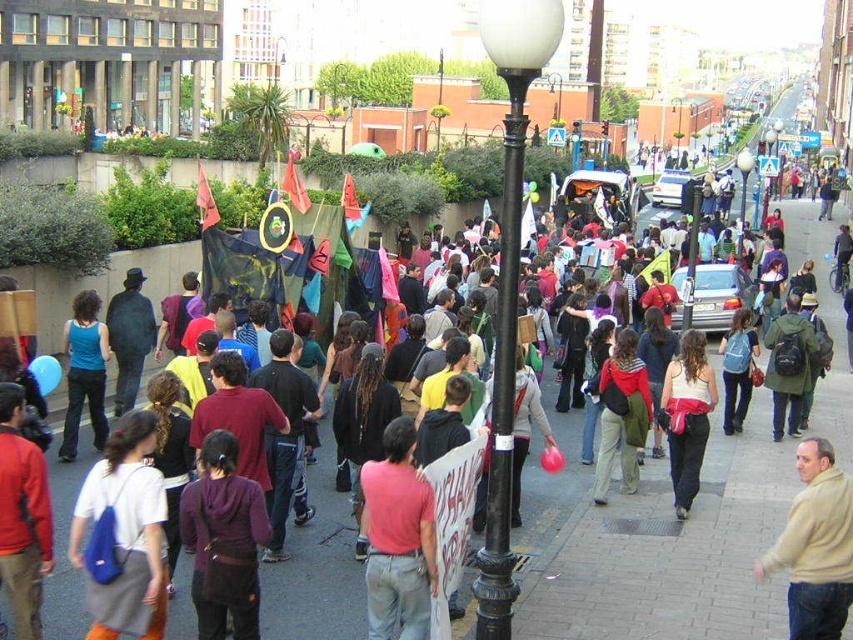
Question: Which of the following is the closest to the observer?

Choices:
 (A) tap(680, 342)
 (B) tap(793, 298)

Answer: (A)

Question: Among these objects, which one is nearest to the camera?

Choices:
 (A) white fabric tank top at center
 (B) beige sweater at lower right
 (C) green matte jacket at center

Answer: (B)

Question: Does blue fabric backpack at lower left have a lesser width compared to matte red sweater at lower left?

Choices:
 (A) no
 (B) yes

Answer: (A)

Question: Which of the following is the closest to the observer?

Choices:
 (A) purple fabric bag at center
 (B) blue fabric backpack at lower left
 (C) matte green backpack at center

Answer: (B)

Question: Is purple fabric bag at center thinner than matte blue tank top at center-left?

Choices:
 (A) yes
 (B) no

Answer: (B)

Question: Does white fabric tank top at center appear on the right side of dark gray coat at center?

Choices:
 (A) no
 (B) yes

Answer: (B)